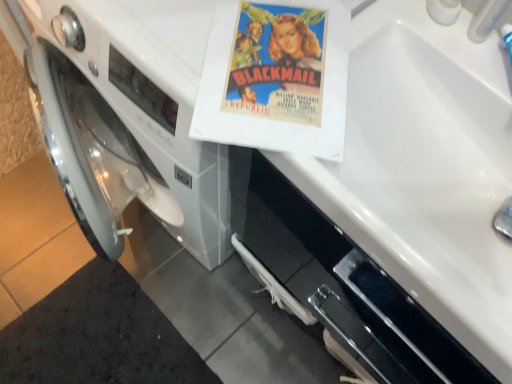
Question: Could white plastic faucet at upper right be considered to be inside matte paper poster at center?

Choices:
 (A) yes
 (B) no

Answer: (B)

Question: Considering the relative positions of matte paper poster at center and white plastic faucet at upper right in the image provided, is matte paper poster at center to the left of white plastic faucet at upper right from the viewer's perspective?

Choices:
 (A) no
 (B) yes

Answer: (B)

Question: From a real-world perspective, is matte paper poster at center over white plastic faucet at upper right?

Choices:
 (A) no
 (B) yes

Answer: (A)

Question: Is matte paper poster at center next to white plastic faucet at upper right and touching it?

Choices:
 (A) yes
 (B) no

Answer: (B)

Question: Is matte paper poster at center to the right of white plastic faucet at upper right from the viewer's perspective?

Choices:
 (A) yes
 (B) no

Answer: (B)

Question: Is matte paper poster at center smaller than white plastic faucet at upper right?

Choices:
 (A) no
 (B) yes

Answer: (A)

Question: From the image's perspective, is white glossy sink at upper right under white plastic faucet at upper right?

Choices:
 (A) no
 (B) yes

Answer: (B)

Question: Can you confirm if white glossy sink at upper right is thinner than white plastic faucet at upper right?

Choices:
 (A) yes
 (B) no

Answer: (B)

Question: Can you confirm if white glossy sink at upper right is taller than white plastic faucet at upper right?

Choices:
 (A) no
 (B) yes

Answer: (A)

Question: Is white plastic faucet at upper right completely or partially inside white glossy sink at upper right?

Choices:
 (A) no
 (B) yes

Answer: (A)

Question: Does white glossy sink at upper right appear on the right side of white plastic faucet at upper right?

Choices:
 (A) yes
 (B) no

Answer: (B)

Question: Is white glossy sink at upper right smaller than white plastic faucet at upper right?

Choices:
 (A) yes
 (B) no

Answer: (B)

Question: Is matte paper poster at center inside white plastic faucet at upper right?

Choices:
 (A) no
 (B) yes

Answer: (A)